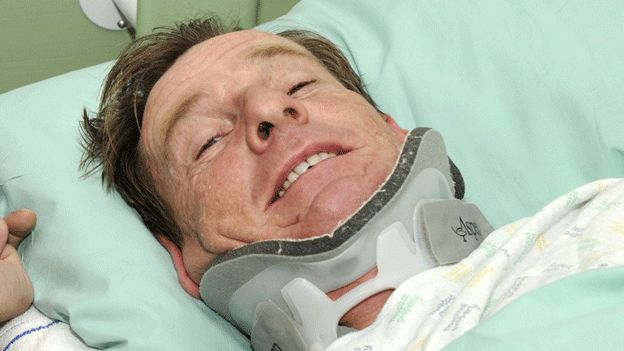
Find the location of a particular element. This screenshot has height=351, width=624. pillow is located at coordinates (132, 305), (532, 81).